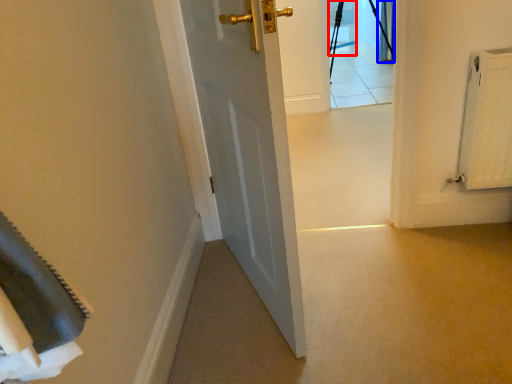
Question: Among these objects, which one is farthest to the camera, chair (highlighted by a red box) or curtain (highlighted by a blue box)?

Choices:
 (A) chair
 (B) curtain

Answer: (A)